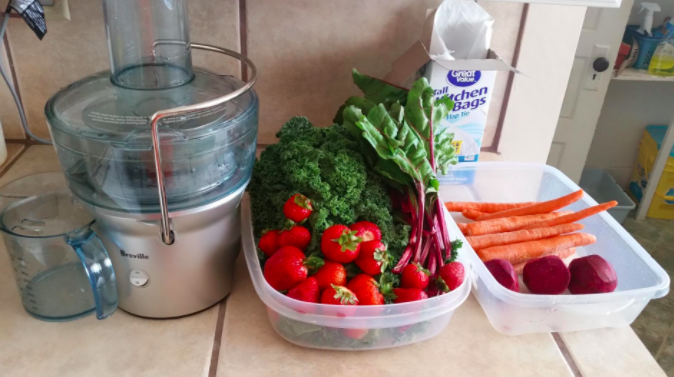
The height and width of the screenshot is (377, 674). What are the coordinates of `shelf` in the screenshot? It's located at (625, 74).